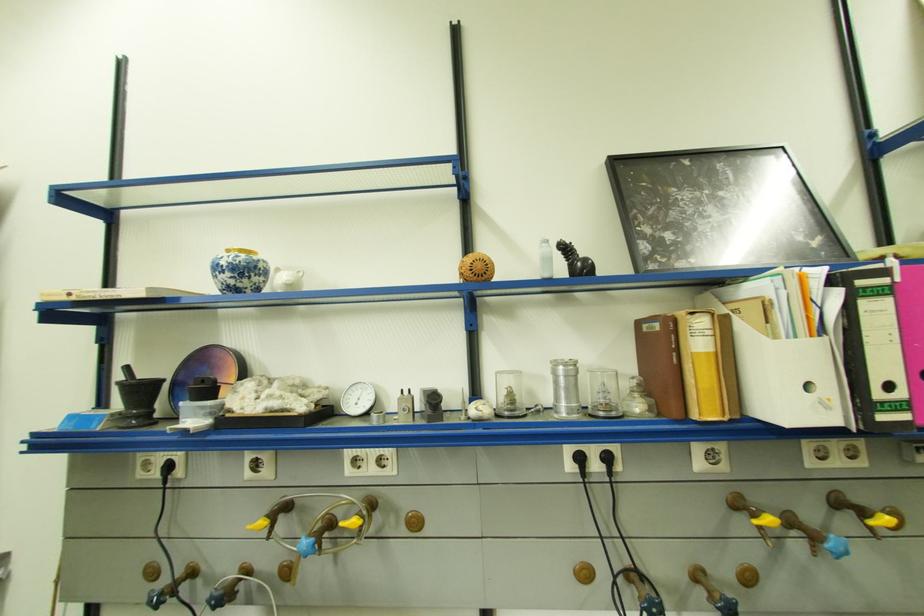
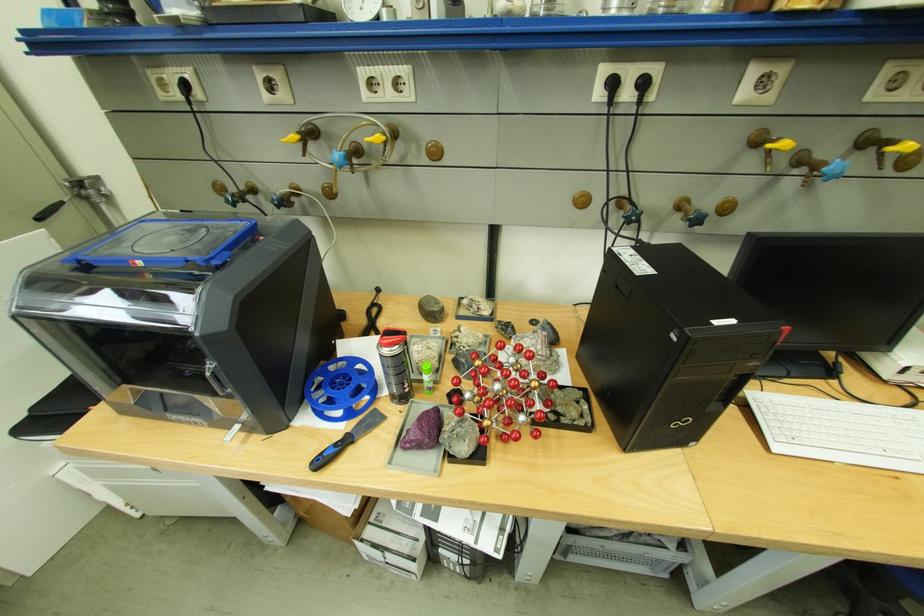
In the second image, find the point that corresponds to [407,512] in the first image.

(428, 140)